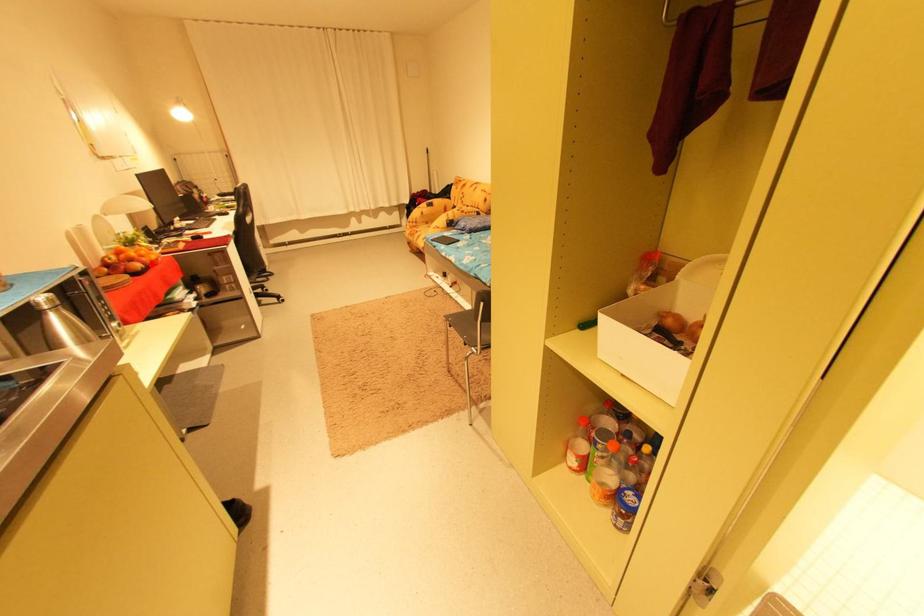
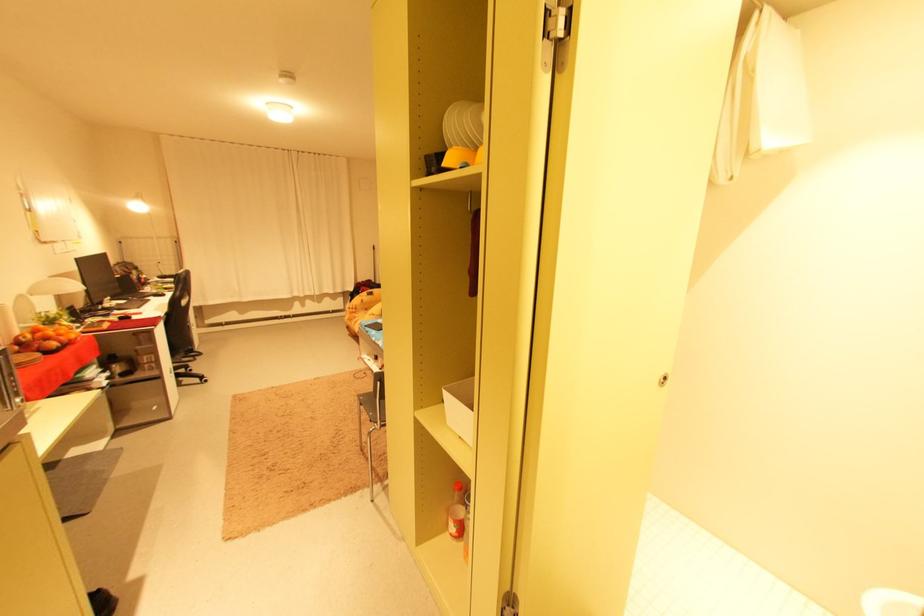
Question: A red point is marked in image1. In image2, is the corresponding 3D point closer to the camera or farther? Reply with the corresponding letter.

Choices:
 (A) The corresponding 3D point is closer.
 (B) The corresponding 3D point is farther.

Answer: (B)